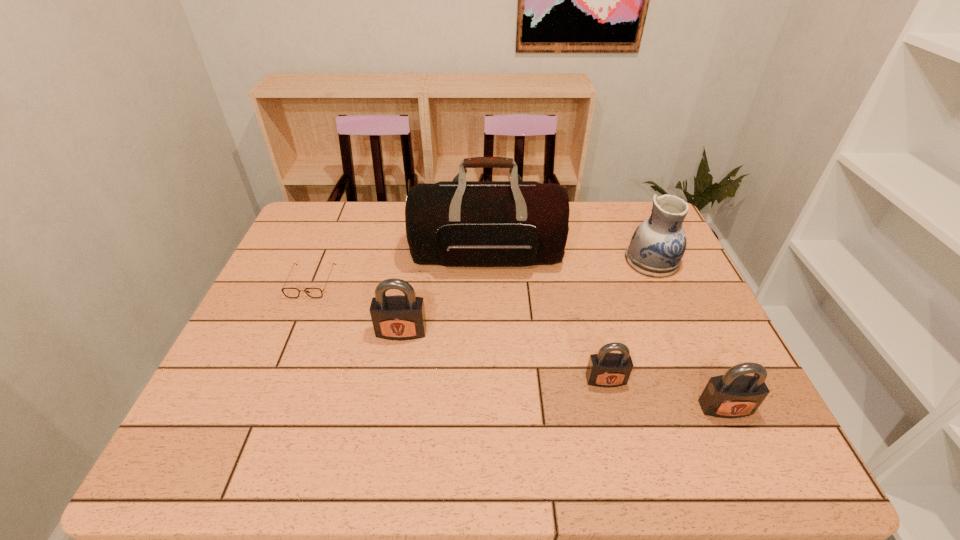
The width and height of the screenshot is (960, 540). What are the coordinates of `the leftmost padlock` in the screenshot? It's located at (398, 317).

The image size is (960, 540). What are the coordinates of `the fourth farthest object` in the screenshot? It's located at (398, 317).

Where is `the second nearest object`? the second nearest object is located at coordinates (605, 369).

Find the location of a particular element. This screenshot has width=960, height=540. the second nearest padlock is located at coordinates (605, 369).

You are a GUI agent. You are given a task and a screenshot of the screen. Output one action in this format:
    pyautogui.click(x=<x>, y=<y>)
    Task: Click on the third shortest object
    The image size is (960, 540).
    Given the screenshot: What is the action you would take?
    pyautogui.click(x=733, y=395)

You are a GUI agent. You are given a task and a screenshot of the screen. Output one action in this format:
    pyautogui.click(x=<x>, y=<y>)
    Task: Click on the rightmost padlock
    The height and width of the screenshot is (540, 960).
    Given the screenshot: What is the action you would take?
    pyautogui.click(x=733, y=395)

You are a GUI agent. You are given a task and a screenshot of the screen. Output one action in this format:
    pyautogui.click(x=<x>, y=<y>)
    Task: Click on the pottery
    
    Given the screenshot: What is the action you would take?
    pyautogui.click(x=657, y=246)

Where is `the leftmost object`? Image resolution: width=960 pixels, height=540 pixels. the leftmost object is located at coordinates (288, 292).

Where is `the shortest object`? The width and height of the screenshot is (960, 540). the shortest object is located at coordinates (288, 292).

This screenshot has width=960, height=540. What are the coordinates of `the tallest object` in the screenshot? It's located at (459, 223).